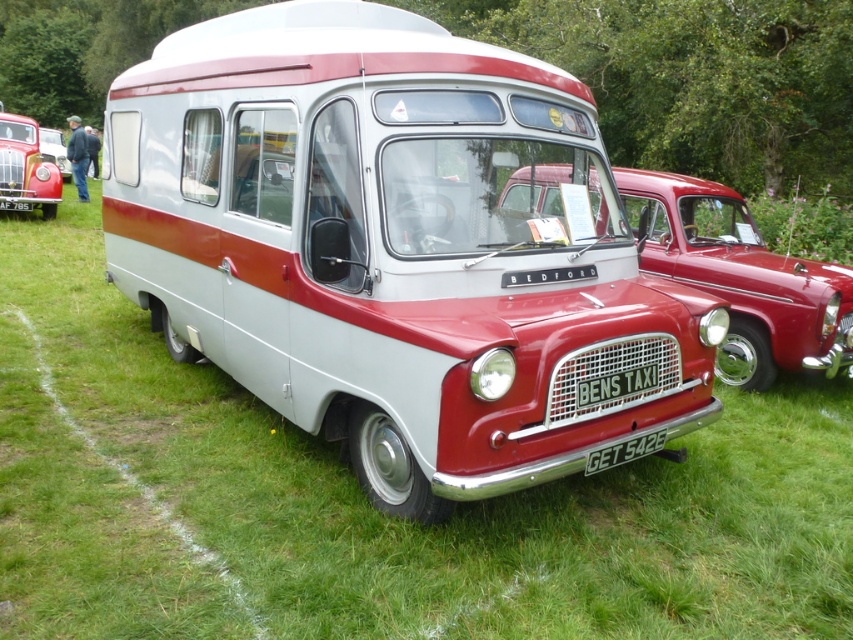
Can you confirm if matte white/red van at center is positioned below shiny red car at left?

Yes.

Is point (171, 45) farther from viewer compared to point (22, 209)?

No, it is not.

Does point (607, 412) lie in front of point (21, 148)?

That is True.

Identify the location of matte white/red van at center. The height and width of the screenshot is (640, 853). (399, 250).

Consider the image. Is matte red taxi at center positioned before shiny red car at left?

Yes, matte red taxi at center is in front of shiny red car at left.

Consider the image. Does matte red taxi at center have a greater width compared to shiny red car at left?

Yes, matte red taxi at center is wider than shiny red car at left.

Does point (709, 276) come behind point (10, 172)?

No.

Find the location of a particular element. The image size is (853, 640). matte red taxi at center is located at coordinates (740, 276).

Does matte white/red van at center have a greater height compared to matte red van at center?

Correct, matte white/red van at center is much taller as matte red van at center.

Based on the photo, how distant is matte white/red van at center from matte red van at center?

12.35 meters

Which is behind, point (543, 173) or point (45, 134)?

Point (45, 134)

Where is `matte white/red van at center`? This screenshot has height=640, width=853. matte white/red van at center is located at coordinates (399, 250).